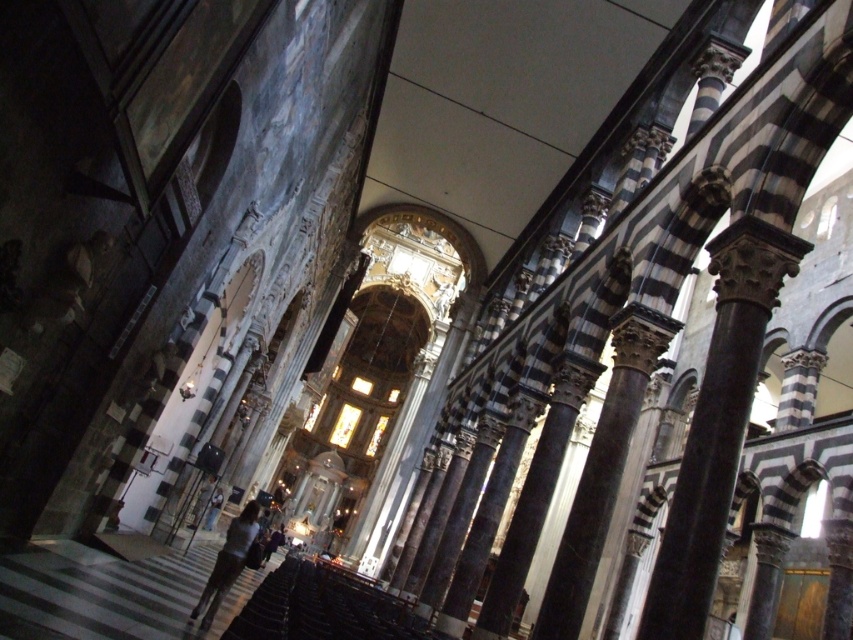
Question: Is black and white striped column at center-right positioned before dark brown leather jacket at lower center?

Choices:
 (A) no
 (B) yes

Answer: (A)

Question: Is black and white striped column at center-right wider than dark brown leather jacket at lower center?

Choices:
 (A) yes
 (B) no

Answer: (A)

Question: Which object appears closest to the camera in this image?

Choices:
 (A) black and white striped column at center-right
 (B) dark brown leather jacket at lower center

Answer: (B)

Question: Does black and white striped column at center-right have a lesser width compared to dark brown leather jacket at lower center?

Choices:
 (A) no
 (B) yes

Answer: (A)

Question: Among these points, which one is farthest from the camera?

Choices:
 (A) 560,632
 (B) 212,595

Answer: (B)